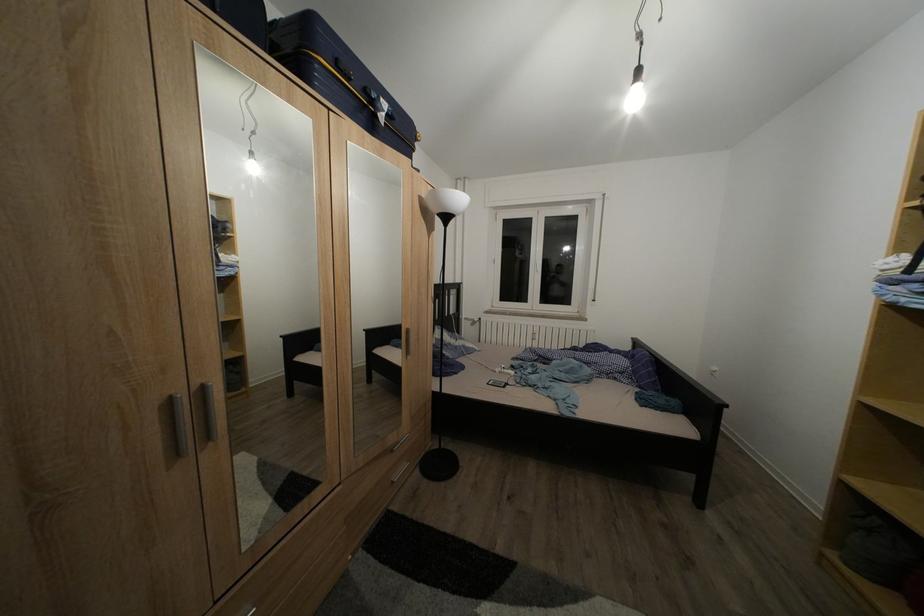
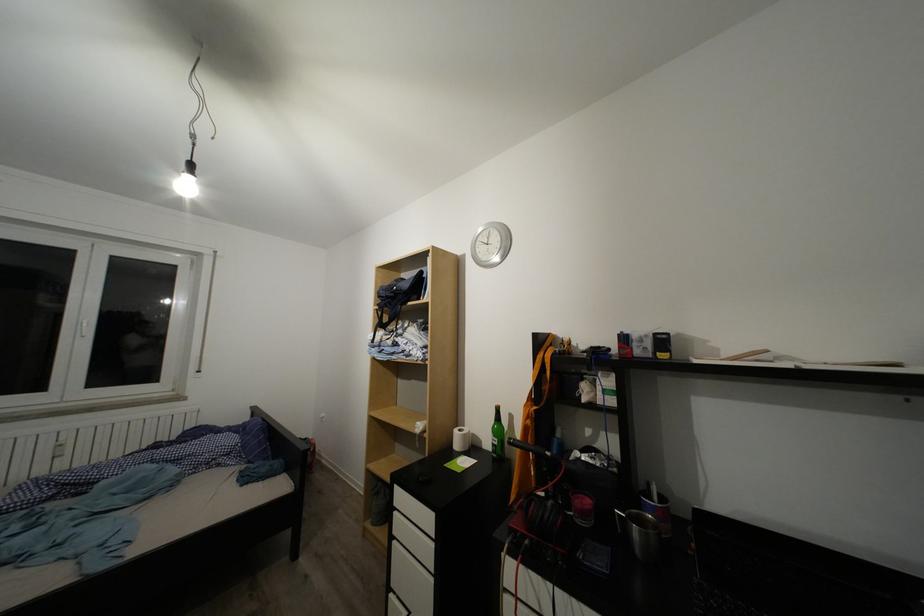
Question: The first image is from the beginning of the video and the second image is from the end. How did the camera likely rotate when shooting the video?

Choices:
 (A) Left
 (B) Right
 (C) Up
 (D) Down

Answer: (B)